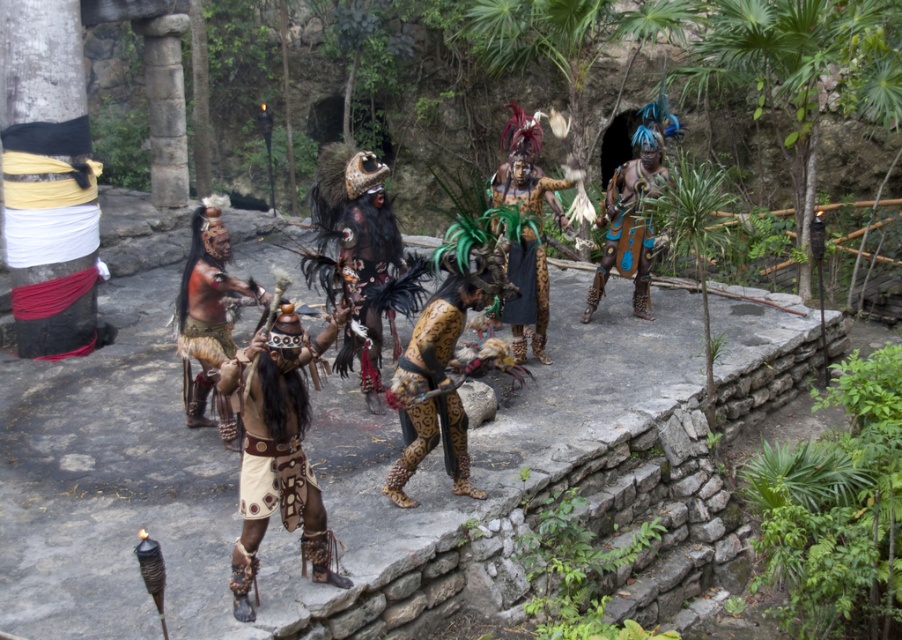
Question: Does leopard print leggings at center have a lesser width compared to blue painted skin at center?

Choices:
 (A) yes
 (B) no

Answer: (A)

Question: Is the position of leopard print leggings at center more distant than that of green feathered headdress at center?

Choices:
 (A) no
 (B) yes

Answer: (A)

Question: Which point appears closest to the camera in this image?

Choices:
 (A) (217, 220)
 (B) (536, 115)

Answer: (A)

Question: From the image, what is the correct spatial relationship of matte brown leather armor at center in relation to green feathered headdress at center?

Choices:
 (A) right
 (B) left

Answer: (B)

Question: Which object is the farthest from the matte brown leather armor at center?

Choices:
 (A) leopard print skirt at center
 (B) leather-like beige skirt at center
 (C) green feathered headdress at center

Answer: (A)

Question: Which point appears closest to the camera in this image?

Choices:
 (A) 268,410
 (B) 216,234
 (C) 511,141

Answer: (A)